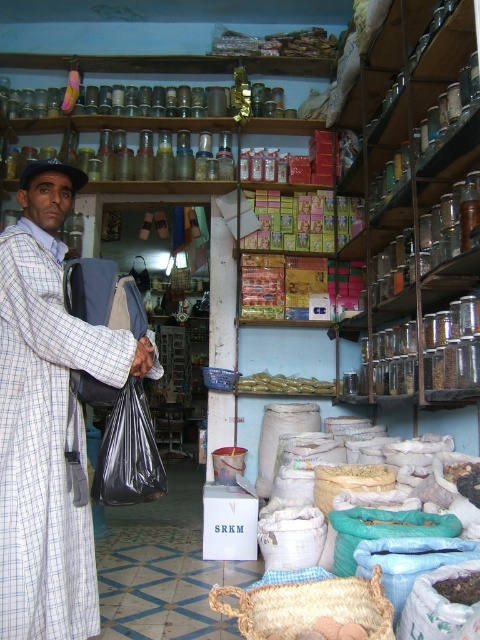
Question: Estimate the real-world distances between objects in this image. Which object is farther from the black plastic bag at left?

Choices:
 (A) plaid fabric man at left
 (B) yellowish-green plastic containers at center

Answer: (B)

Question: Which point is farther to the camera?

Choices:
 (A) (129, 458)
 (B) (314, 392)
 (C) (51, 285)

Answer: (B)

Question: Which object is closer to the camera taking this photo?

Choices:
 (A) yellowish-green plastic containers at center
 (B) plaid fabric man at left

Answer: (B)

Question: Does black plastic bag at left appear on the left side of yellowish-green plastic containers at center?

Choices:
 (A) no
 (B) yes

Answer: (B)

Question: Can you confirm if black plastic bag at left is thinner than yellowish-green plastic containers at center?

Choices:
 (A) no
 (B) yes

Answer: (B)

Question: Is the position of plaid fabric man at left less distant than that of yellowish-green plastic containers at center?

Choices:
 (A) no
 (B) yes

Answer: (B)